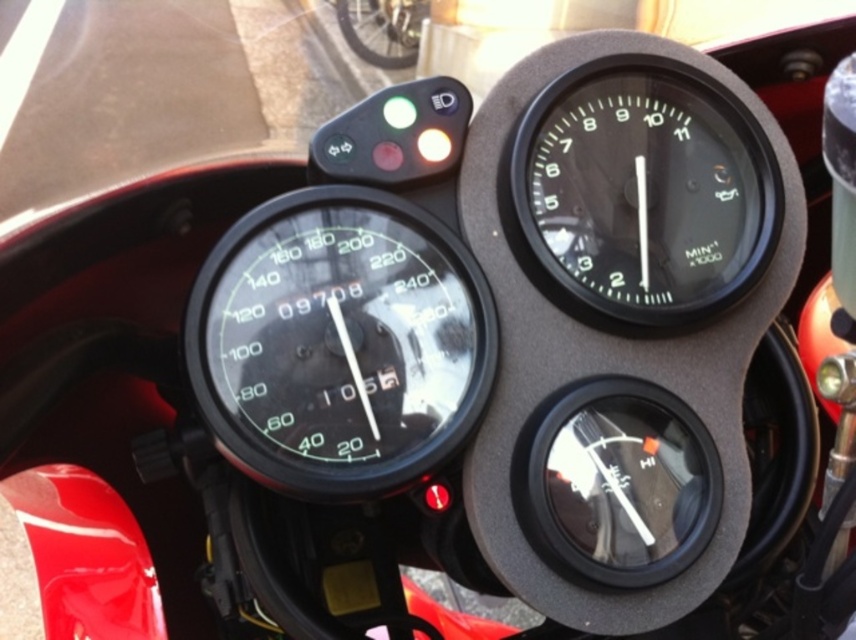
You are a mechanic checking the motorcycle dashboard. You need to replace the black glass speedometer at center and the black glass tachometer at upper right. Which gauge requires a larger replacement part?

The black glass speedometer at center requires a larger replacement part because its width is greater than the black glass tachometer at upper right.

What is the current speed displayed on the black glass speedometer at center?

The current speed displayed on the black glass speedometer at center is approximately 105 km per hour.